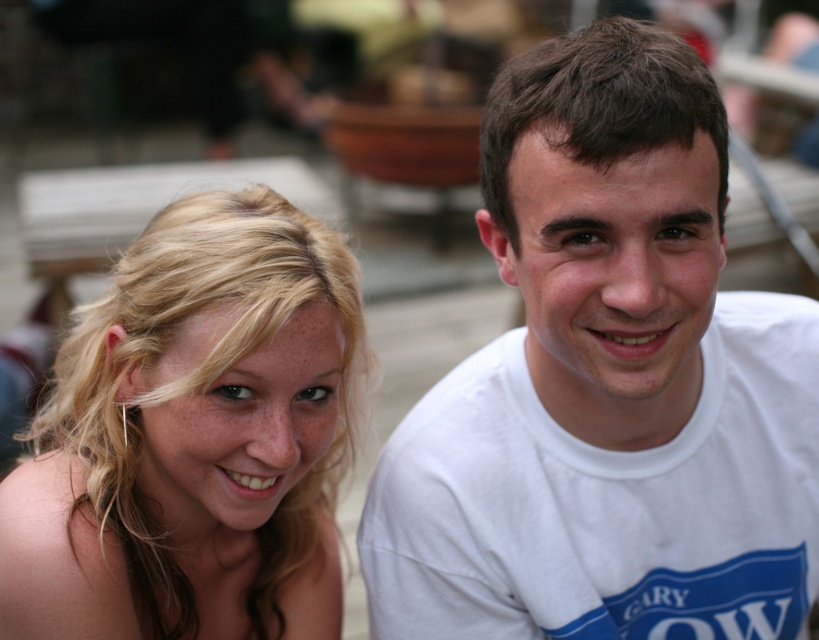
You are standing at the point marked by the coordinates point [713,93] in the image. You want to take a photo of the two people in the scene. Can you see them clearly from your current position?

Yes, you can see the two people clearly from the point [713,93] because the distance between you and the viewer is 4.13 feet, which is close enough for a clear view.